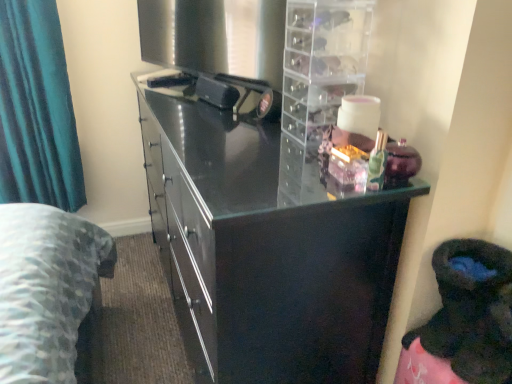
Question: From a real-world perspective, is clear plastic drawer unit at upper right on top of glossy black cupboard at center?

Choices:
 (A) no
 (B) yes

Answer: (B)

Question: Is clear plastic drawer unit at upper right taller than glossy black cupboard at center?

Choices:
 (A) no
 (B) yes

Answer: (A)

Question: Could you tell me if clear plastic drawer unit at upper right is facing glossy black cupboard at center?

Choices:
 (A) yes
 (B) no

Answer: (B)

Question: Does clear plastic drawer unit at upper right lie behind glossy black cupboard at center?

Choices:
 (A) yes
 (B) no

Answer: (A)

Question: Considering the relative sizes of clear plastic drawer unit at upper right and glossy black cupboard at center in the image provided, is clear plastic drawer unit at upper right bigger than glossy black cupboard at center?

Choices:
 (A) yes
 (B) no

Answer: (B)

Question: Does clear plastic drawer unit at upper right appear on the left side of glossy black cupboard at center?

Choices:
 (A) yes
 (B) no

Answer: (B)

Question: Is glossy black cupboard at center not within teal fabric curtain at left?

Choices:
 (A) yes
 (B) no

Answer: (A)

Question: Is glossy black cupboard at center smaller than teal fabric curtain at left?

Choices:
 (A) yes
 (B) no

Answer: (B)

Question: Is glossy black cupboard at center far from teal fabric curtain at left?

Choices:
 (A) yes
 (B) no

Answer: (A)

Question: Is teal fabric curtain at left at the back of glossy black cupboard at center?

Choices:
 (A) no
 (B) yes

Answer: (A)

Question: From the image's perspective, does glossy black cupboard at center appear lower than teal fabric curtain at left?

Choices:
 (A) yes
 (B) no

Answer: (A)

Question: Can you confirm if glossy black cupboard at center is bigger than teal fabric curtain at left?

Choices:
 (A) yes
 (B) no

Answer: (A)

Question: Is glossy black cupboard at center thinner than clear plastic drawer unit at upper right?

Choices:
 (A) yes
 (B) no

Answer: (B)